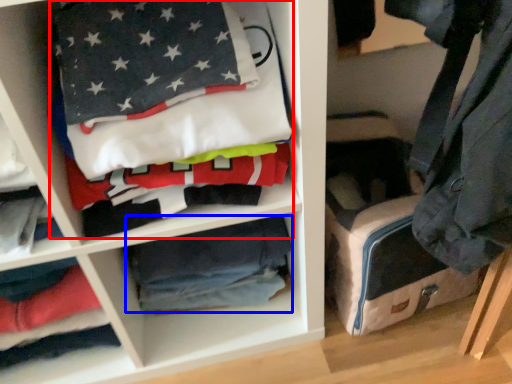
Question: Which object appears farthest to the camera in this image, laundry (highlighted by a red box) or material (highlighted by a blue box)?

Choices:
 (A) laundry
 (B) material

Answer: (B)